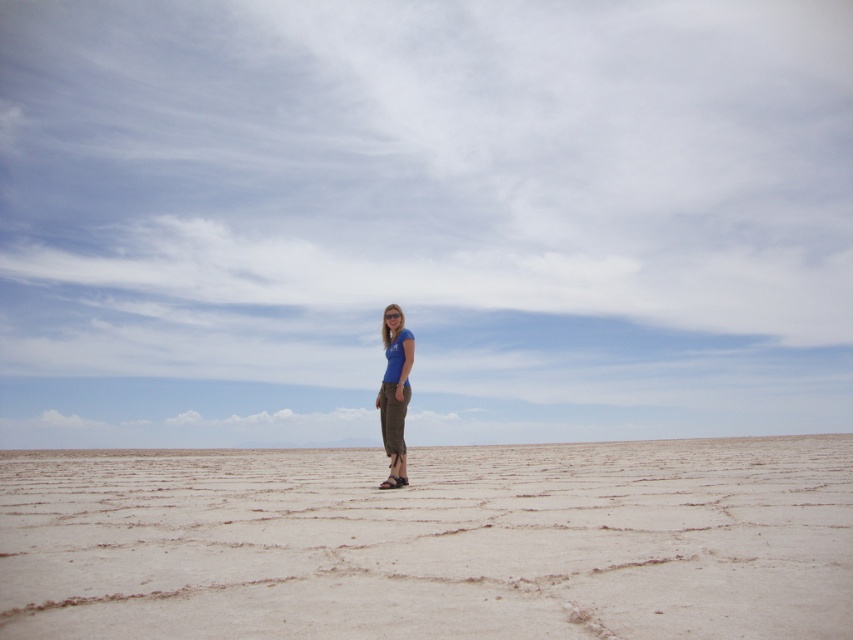
You are standing in the desert and see two points marked on the ground. Which point is closer to you, point (519,465) or point (412,337)?

Point (412,337) is closer to you because it is less further to the viewer than point (519,465).

You are a photographer standing in the desert scene. You want to capture a photo where the light brown sandy at center is to the right of the blue fabric pants at center. Is this possible with the current arrangement?

Yes, because the light brown sandy at center is already positioned on the right side of the blue fabric pants at center according to the description.